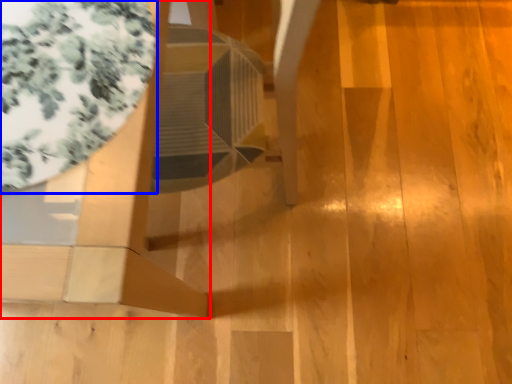
Question: Which object is further to the camera taking this photo, furniture (highlighted by a red box) or glass table (highlighted by a blue box)?

Choices:
 (A) furniture
 (B) glass table

Answer: (B)